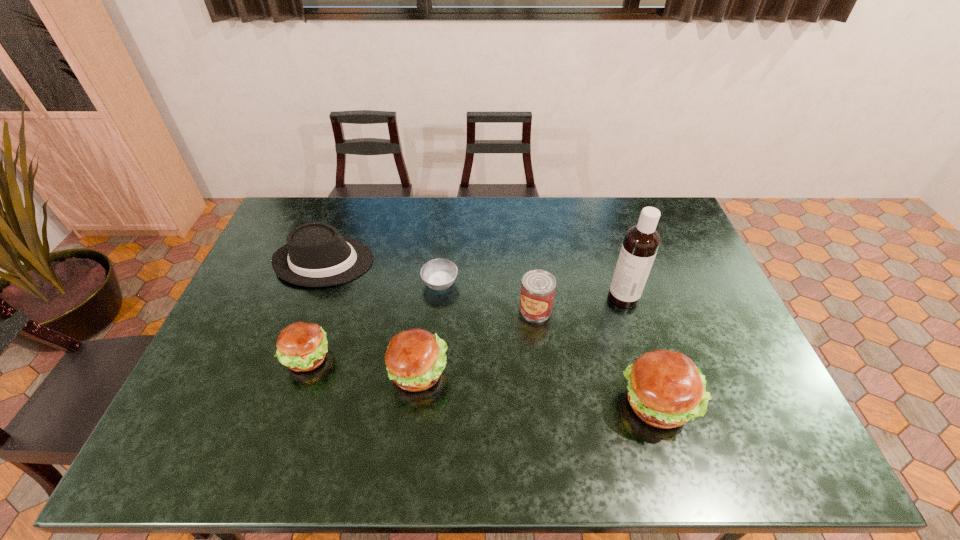
Where is `free spot between the rightmost hamburger and the fedora`? This screenshot has height=540, width=960. free spot between the rightmost hamburger and the fedora is located at coordinates (491, 332).

Where is `free point between the third object from right to left and the shortest object`? free point between the third object from right to left and the shortest object is located at coordinates (488, 296).

The height and width of the screenshot is (540, 960). What are the coordinates of `free space between the dishwasher detergent and the fifth object from left to right` in the screenshot? It's located at (580, 303).

Locate an element on the screen. The height and width of the screenshot is (540, 960). the sixth closest object to the fedora is located at coordinates (665, 389).

Find the location of a particular element. The height and width of the screenshot is (540, 960). object that is the fourth closest to the rightmost hamburger is located at coordinates (439, 274).

Identify which hamburger is located as the nearest to the shortest hamburger. Please provide its 2D coordinates. Your answer should be formatted as a tuple, i.e. [(x, y)], where the tuple contains the x and y coordinates of a point satisfying the conditions above.

[(415, 358)]

Identify which hamburger is the third nearest to the shortest object. Please provide its 2D coordinates. Your answer should be formatted as a tuple, i.e. [(x, y)], where the tuple contains the x and y coordinates of a point satisfying the conditions above.

[(665, 389)]

Identify the location of vacant space that satisfies the following two spatial constraints: 1. on the front-facing side of the fedora; 2. on the right side of the second hamburger from left to right. (284, 372).

I want to click on blank space that satisfies the following two spatial constraints: 1. on the label side of the dishwasher detergent; 2. on the back side of the rightmost hamburger, so click(656, 402).

Locate an element on the screen. The height and width of the screenshot is (540, 960). vacant space that satisfies the following two spatial constraints: 1. on the front side of the rightmost hamburger; 2. on the right side of the shortest object is located at coordinates (429, 402).